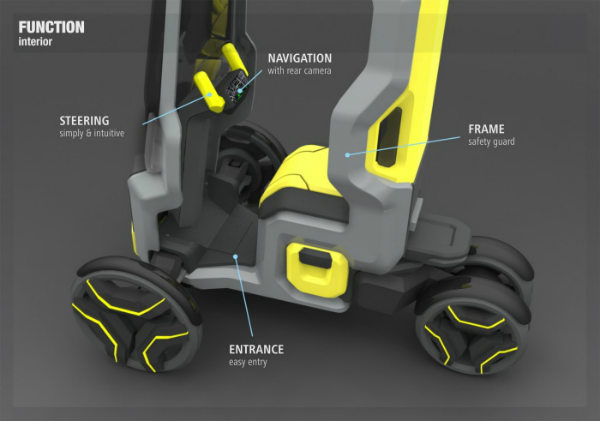
This screenshot has width=600, height=421. In order to click on light gray and yellow plastic frame in this screenshot , I will do `click(360, 102)`.